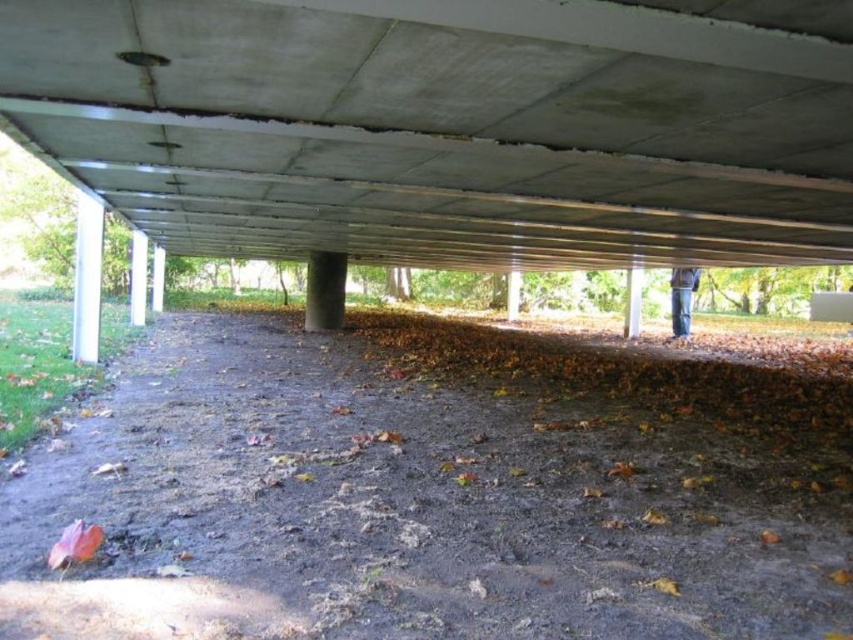
You are a delivery person carrying a package that is 6 feet tall. You need to pass under the structure shown in the image. Can you safely pass under the concrete ceiling at center without hitting the dirt ground at center?

The concrete ceiling at center and dirt ground at center are 6.07 feet apart from each other. Since the package is 6 feet tall, which is slightly shorter than the available space, you can safely pass under the concrete ceiling at center without hitting the dirt ground at center.

You are an engineer inspecting the structural integrity of the concrete ceiling at center and the dirt ground at center. Which of these two objects has a smaller thickness?

The concrete ceiling at center is thinner than dirt ground at center, so the concrete ceiling at center has a smaller thickness.

You are standing under a bridge and want to know which area is larger in the image. Which one takes up more space between the concrete ceiling at center and the dirt ground at center?

The dirt ground at center occupies more space than the concrete ceiling at center, as the concrete ceiling at center is described as occupying less space than the dirt ground at center.